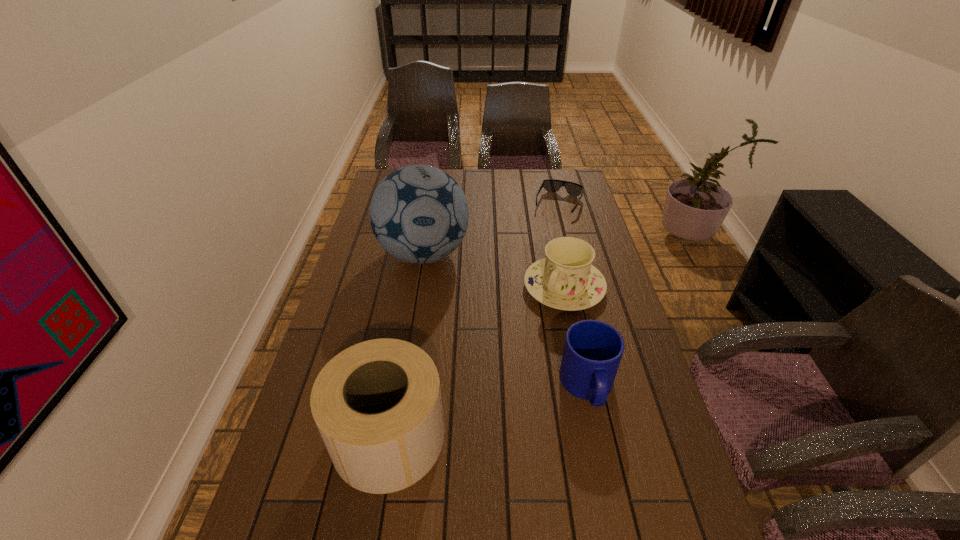
Where is `mug that is at the right edge`? mug that is at the right edge is located at coordinates (592, 352).

Find the location of a particular element. The width and height of the screenshot is (960, 540). sunglasses at the right edge is located at coordinates point(551,185).

The width and height of the screenshot is (960, 540). In order to click on chinaware that is at the right edge in this screenshot , I will do `click(565, 280)`.

The height and width of the screenshot is (540, 960). I want to click on object that is positioned at the far right corner, so click(x=551, y=185).

Where is `vacant position at the far edge of the desktop`? The height and width of the screenshot is (540, 960). vacant position at the far edge of the desktop is located at coordinates (541, 179).

Locate an element on the screen. This screenshot has width=960, height=540. vacant space at the near edge of the desktop is located at coordinates (433, 518).

Where is `vacant area at the left edge`? The image size is (960, 540). vacant area at the left edge is located at coordinates (381, 328).

In order to click on free spot at the right edge of the desktop in this screenshot , I will do `click(636, 338)`.

Locate an element on the screen. The width and height of the screenshot is (960, 540). vacant area between the sunglasses and the tallest object is located at coordinates (492, 230).

Identify the location of vacant space in between the tallest object and the chinaware. (493, 271).